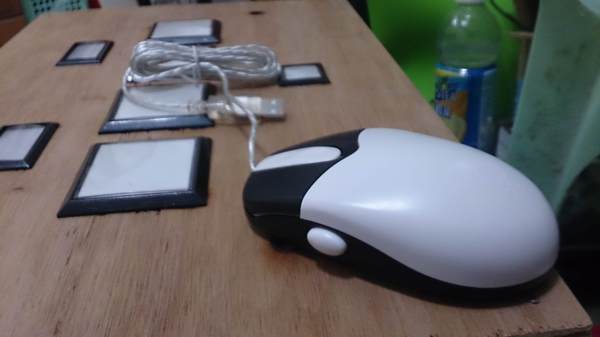
Identify the location of wooden table. Image resolution: width=600 pixels, height=337 pixels. (218, 287).